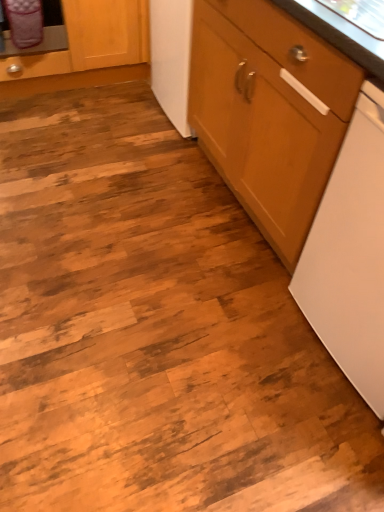
Question: In terms of width, does white matte dishwasher at right look wider or thinner when compared to wooden cabinet at right, the first cabinetry positioned from the right?

Choices:
 (A) wide
 (B) thin

Answer: (B)

Question: Is white matte dishwasher at right to the left or to the right of wooden cabinet at right, the first cabinetry positioned from the right, in the image?

Choices:
 (A) left
 (B) right

Answer: (B)

Question: Which is farther from the wooden cabinet at right, the 2th cabinetry positioned from the left?

Choices:
 (A) white matte dishwasher at right
 (B) wooden cabinet at upper left, the first cabinetry when ordered from left to right

Answer: (B)

Question: Which object is the closest to the wooden cabinet at right, the first cabinetry positioned from the right?

Choices:
 (A) white matte dishwasher at right
 (B) wooden cabinet at upper left, the first cabinetry when ordered from left to right

Answer: (A)